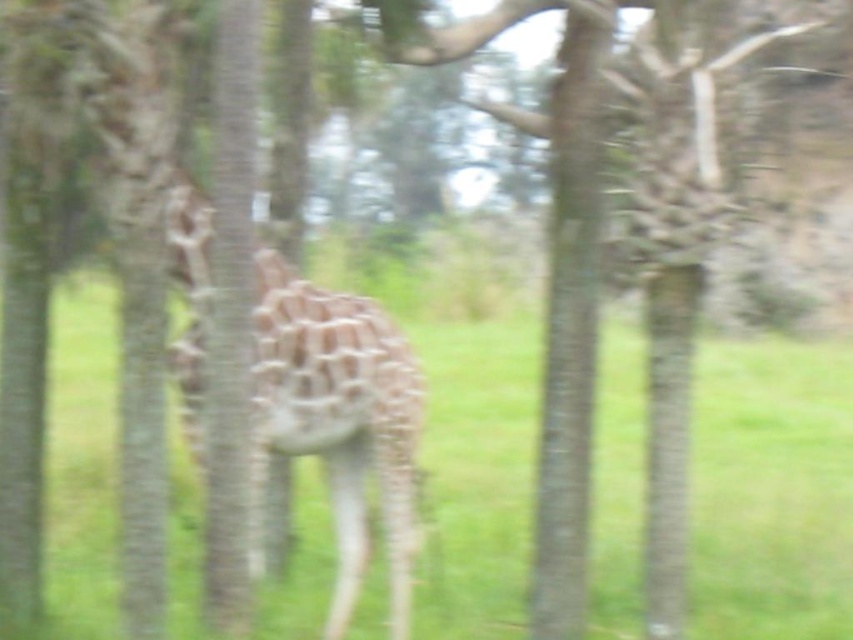
Question: Is smooth bark tree trunk at center positioned in front of brown rough tree trunk at center?

Choices:
 (A) no
 (B) yes

Answer: (A)

Question: Among these objects, which one is farthest from the camera?

Choices:
 (A) brown rough tree trunk at center
 (B) smooth bark tree trunk at center

Answer: (B)

Question: Is smooth bark tree trunk at center to the right of brown rough tree trunk at center from the viewer's perspective?

Choices:
 (A) no
 (B) yes

Answer: (B)

Question: Is the position of smooth bark tree trunk at center more distant than that of brown rough tree trunk at center?

Choices:
 (A) yes
 (B) no

Answer: (A)